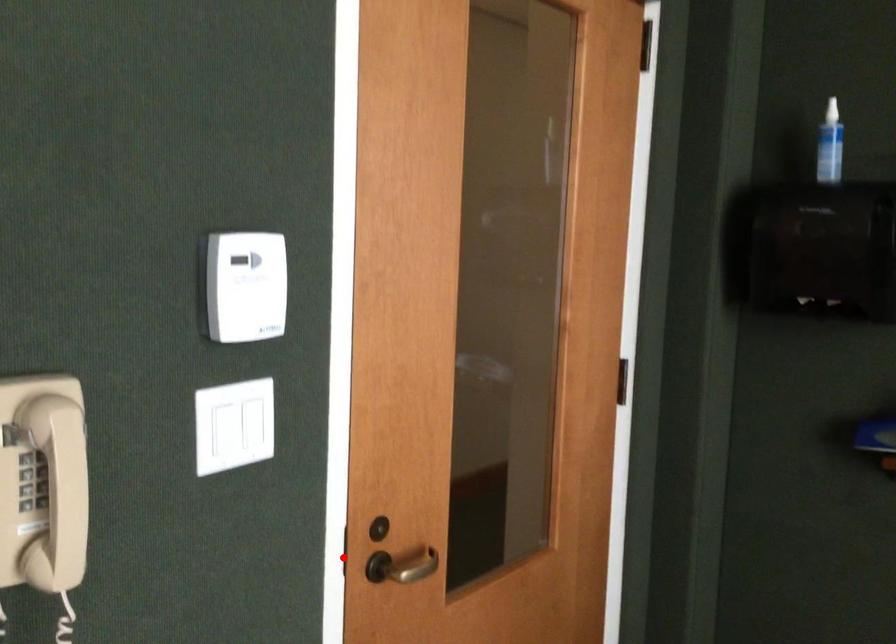
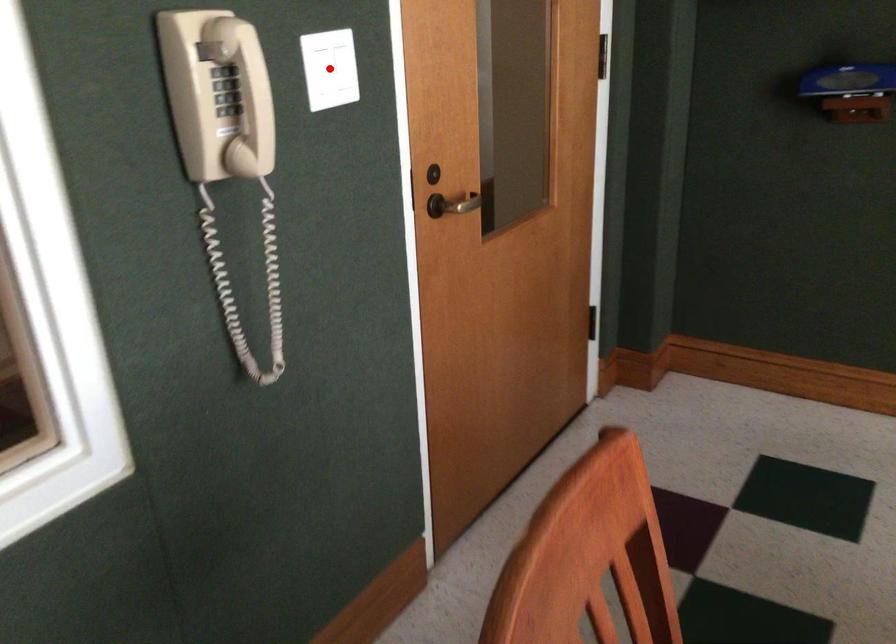
I am providing you with two images of the same scene from different viewpoints. A red point is marked on the first image and another point is marked on the second image. Do the highlighted points in image1 and image2 indicate the same real-world spot?

No